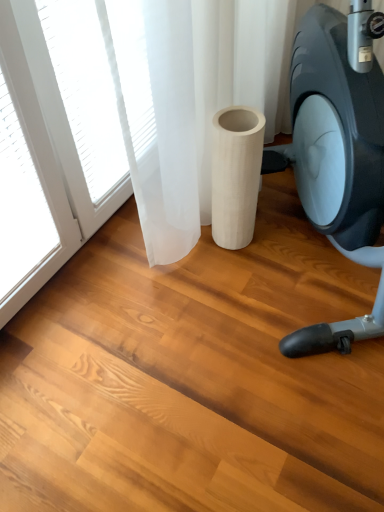
Where is `matte black stationary bicycle at right`? The width and height of the screenshot is (384, 512). matte black stationary bicycle at right is located at coordinates (339, 153).

The height and width of the screenshot is (512, 384). What do you see at coordinates (339, 153) in the screenshot? I see `matte black stationary bicycle at right` at bounding box center [339, 153].

Measure the distance between matte black stationary bicycle at right and camera.

matte black stationary bicycle at right and camera are 1.01 meters apart.

This screenshot has width=384, height=512. What do you see at coordinates (236, 174) in the screenshot?
I see `white wood cylinder at center` at bounding box center [236, 174].

Where is `white wood cylinder at center`? The height and width of the screenshot is (512, 384). white wood cylinder at center is located at coordinates (236, 174).

Where is `matte black stationary bicycle at right`? This screenshot has width=384, height=512. matte black stationary bicycle at right is located at coordinates (339, 153).

Is matte black stationary bicycle at right at the left side of white wood cylinder at center?

In fact, matte black stationary bicycle at right is to the right of white wood cylinder at center.

Who is more distant, matte black stationary bicycle at right or white wood cylinder at center?

Positioned behind is white wood cylinder at center.

Does point (325, 226) come behind point (261, 150)?

Yes, point (325, 226) is behind point (261, 150).

From the image's perspective, does matte black stationary bicycle at right appear lower than white wood cylinder at center?

No, from the image's perspective, matte black stationary bicycle at right is not below white wood cylinder at center.

From a real-world perspective, which is physically above, matte black stationary bicycle at right or white wood cylinder at center?

In real-world perspective, matte black stationary bicycle at right is above.

Considering the relative sizes of matte black stationary bicycle at right and white wood cylinder at center in the image provided, is matte black stationary bicycle at right wider than white wood cylinder at center?

Yes.

In the scene shown: Who is taller, matte black stationary bicycle at right or white wood cylinder at center?

Standing taller between the two is matte black stationary bicycle at right.

In the scene shown: Between matte black stationary bicycle at right and white wood cylinder at center, which one has larger size?

matte black stationary bicycle at right.

Is matte black stationary bicycle at right inside the boundaries of white wood cylinder at center, or outside?

The correct answer is: outside.

Is matte black stationary bicycle at right directly adjacent to white wood cylinder at center?

They are not placed beside each other.

Based on the photo, is matte black stationary bicycle at right oriented away from white wood cylinder at center?

That's not correct — matte black stationary bicycle at right is not looking away from white wood cylinder at center.

What's the angular difference between matte black stationary bicycle at right and white wood cylinder at center's facing directions?

0.000178 degrees.

You are a GUI agent. You are given a task and a screenshot of the screen. Output one action in this format:
    pyautogui.click(x=<x>, y=<y>)
    Task: Click on the paper towel behind the matte black stationary bicycle at right
    The height and width of the screenshot is (512, 384).
    Given the screenshot: What is the action you would take?
    pyautogui.click(x=236, y=174)

Which is more to the left, white wood cylinder at center or matte black stationary bicycle at right?

From the viewer's perspective, white wood cylinder at center appears more on the left side.

In the scene shown: Between white wood cylinder at center and matte black stationary bicycle at right, which one is positioned in front?

matte black stationary bicycle at right is more forward.

Which is more distant, (x=227, y=239) or (x=382, y=189)?

The point (x=227, y=239) is more distant.

From the image's perspective, is white wood cylinder at center located above or below matte black stationary bicycle at right?

Clearly, from the image's perspective, white wood cylinder at center is below matte black stationary bicycle at right.

From a real-world perspective, which is physically below, white wood cylinder at center or matte black stationary bicycle at right?

white wood cylinder at center.

Based on the photo, between white wood cylinder at center and matte black stationary bicycle at right, which one has smaller width?

white wood cylinder at center is thinner.

Which of these two, white wood cylinder at center or matte black stationary bicycle at right, stands shorter?

white wood cylinder at center.

Who is smaller, white wood cylinder at center or matte black stationary bicycle at right?

Smaller between the two is white wood cylinder at center.

Would you say white wood cylinder at center contains matte black stationary bicycle at right?

That's incorrect, matte black stationary bicycle at right is not inside white wood cylinder at center.

Is white wood cylinder at center with matte black stationary bicycle at right?

No, white wood cylinder at center is not touching matte black stationary bicycle at right.

Is white wood cylinder at center oriented towards matte black stationary bicycle at right?

Yes, white wood cylinder at center is oriented towards matte black stationary bicycle at right.

Identify the location of stationary bicycle above the white wood cylinder at center (from a real-world perspective). The image size is (384, 512). (339, 153).

Locate an element on the screen. This screenshot has height=512, width=384. stationary bicycle above the white wood cylinder at center (from a real-world perspective) is located at coordinates (339, 153).

I want to click on paper towel behind the matte black stationary bicycle at right, so click(x=236, y=174).